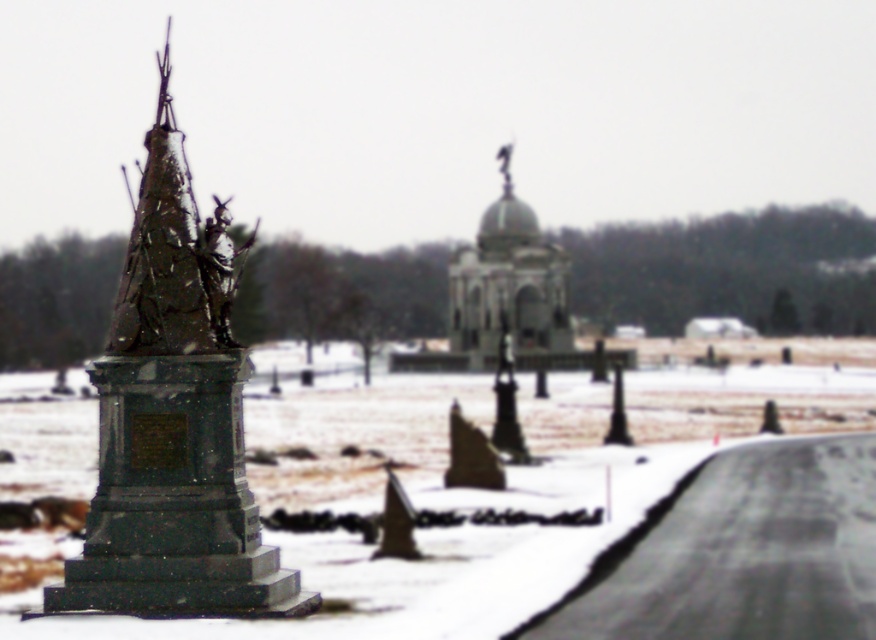
Between bronze statue at left and smooth gray dome at center, which one has less height?

smooth gray dome at center

Who is more forward, (58, 589) or (488, 328)?

Point (58, 589)

Between point (258, 557) and point (556, 339), which one is positioned in front?

Point (258, 557) is in front.

You are a GUI agent. You are given a task and a screenshot of the screen. Output one action in this format:
    pyautogui.click(x=<x>, y=<y>)
    Task: Click on the bronze statue at left
    Image resolution: width=876 pixels, height=640 pixels.
    Given the screenshot: What is the action you would take?
    pyautogui.click(x=174, y=422)